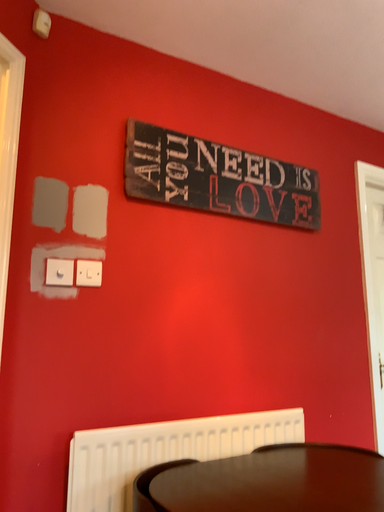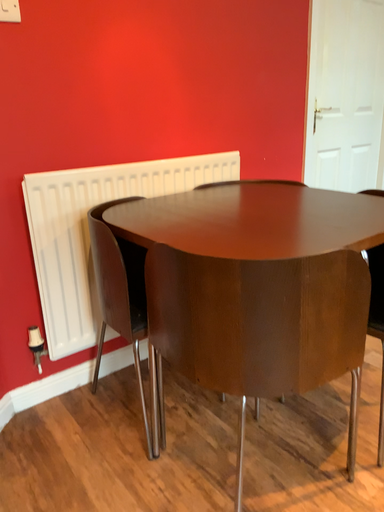
Question: How did the camera likely rotate when shooting the video?

Choices:
 (A) rotated upward
 (B) rotated downward

Answer: (B)